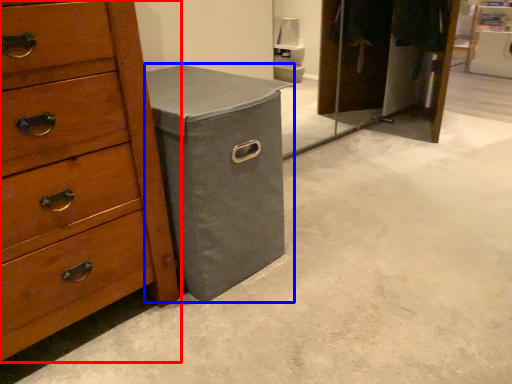
Question: Which object is closer to the camera taking this photo, chest of drawers (highlighted by a red box) or cabinetry (highlighted by a blue box)?

Choices:
 (A) chest of drawers
 (B) cabinetry

Answer: (A)